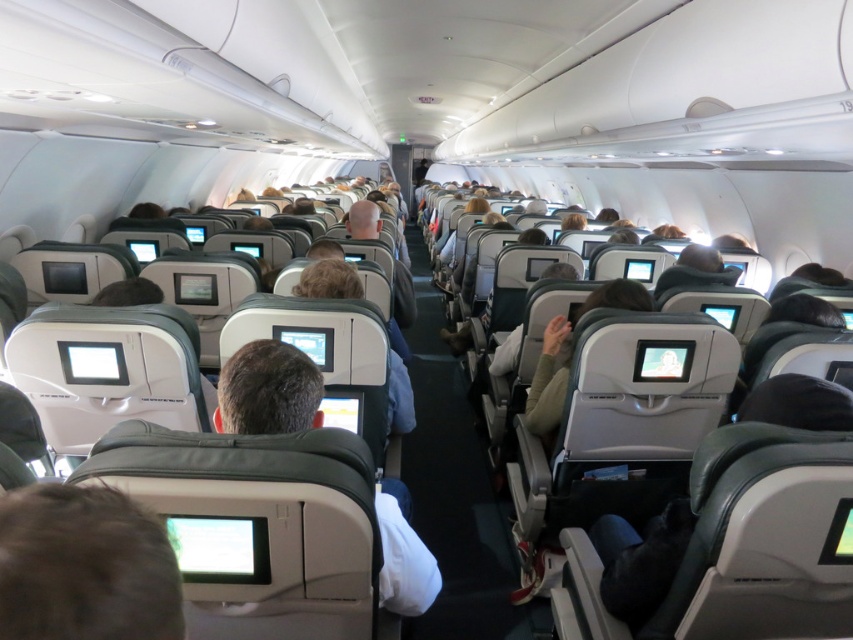
Does dark brown hair at lower left lie behind matte gray seat at center?

No, dark brown hair at lower left is closer to the viewer.

Looking at this image, who is positioned more to the left, dark brown hair at lower left or matte gray seat at center?

dark brown hair at lower left

You are a GUI agent. You are given a task and a screenshot of the screen. Output one action in this format:
    pyautogui.click(x=<x>, y=<y>)
    Task: Click on the dark brown hair at lower left
    Image resolution: width=853 pixels, height=640 pixels.
    Given the screenshot: What is the action you would take?
    pyautogui.click(x=84, y=566)

At what (x,y) coordinates should I click in order to perform the action: click on dark brown hair at lower left. Please return your answer as a coordinate pair (x, y). Looking at the image, I should click on (84, 566).